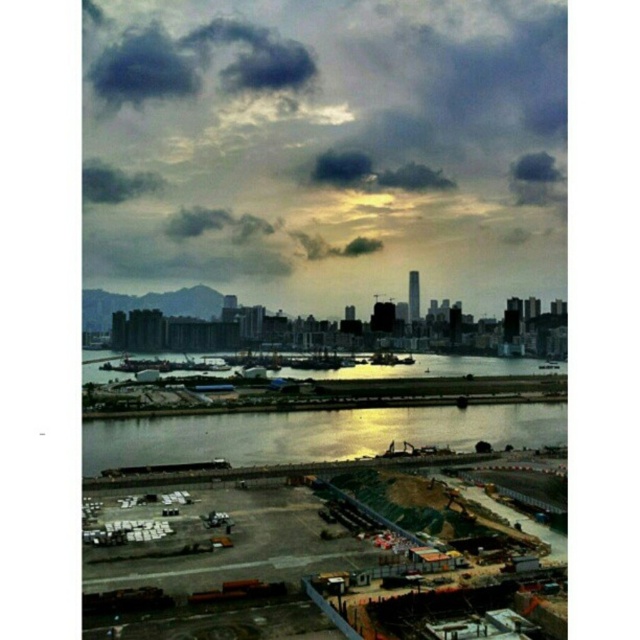
Question: Is dark gray cloud at upper center below reflective glass waterway at center?

Choices:
 (A) yes
 (B) no

Answer: (B)

Question: Estimate the real-world distances between objects in this image. Which object is closer to the reflective glass waterway at center?

Choices:
 (A) dark gray cloud at upper center
 (B) dark gray cloud at upper left

Answer: (A)

Question: Which point is closer to the camera?

Choices:
 (A) dark gray cloud at upper left
 (B) reflective glass waterway at center
 (C) dark gray cloud at upper center

Answer: (B)

Question: Can you confirm if reflective glass waterway at center is thinner than dark gray cloud at upper left?

Choices:
 (A) no
 (B) yes

Answer: (A)

Question: Among these points, which one is nearest to the camera?

Choices:
 (A) (364, 448)
 (B) (104, 125)
 (C) (84, 195)

Answer: (A)

Question: Can you confirm if dark gray cloud at upper center is positioned to the left of reflective glass waterway at center?

Choices:
 (A) no
 (B) yes

Answer: (B)